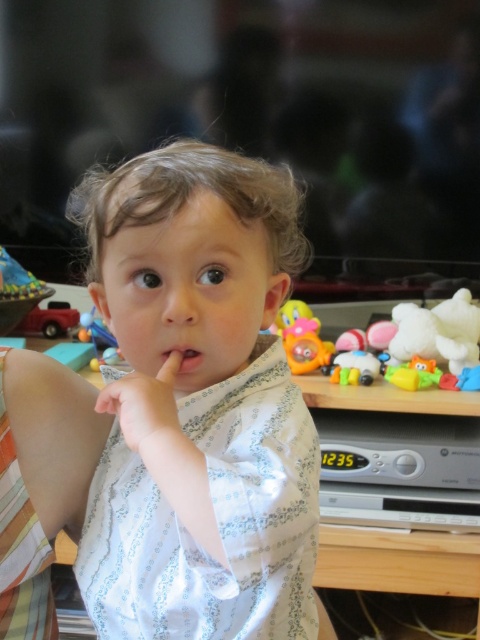
Question: Does plastic yellow duckling at right have a smaller size compared to smooth skin hand at center?

Choices:
 (A) no
 (B) yes

Answer: (A)

Question: Which of the following is the farthest from the observer?

Choices:
 (A) (312, 348)
 (B) (158, 380)
 (C) (267, 172)

Answer: (A)

Question: Can you confirm if white printed shirt at center is positioned to the left of plastic yellow duckling at right?

Choices:
 (A) yes
 (B) no

Answer: (A)

Question: Among these objects, which one is farthest from the camera?

Choices:
 (A) smooth skin hand at center
 (B) plastic yellow duckling at right
 (C) white printed shirt at center
 (D) pink matte flesh at center

Answer: (B)

Question: Among these points, which one is nearest to the camera?

Choices:
 (A) (406, 308)
 (B) (175, 422)
 (C) (173, 365)

Answer: (B)

Question: From the image, what is the correct spatial relationship of white printed shirt at center in relation to smooth skin hand at center?

Choices:
 (A) left
 (B) right

Answer: (B)